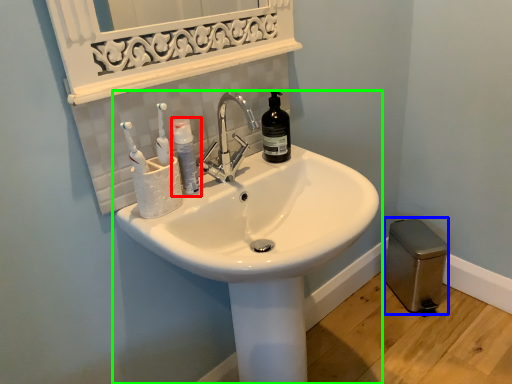
Question: Based on their relative distances, which object is farther from mouthwash (highlighted by a red box)? Choose from gray (highlighted by a blue box) and sink (highlighted by a green box).

Choices:
 (A) gray
 (B) sink

Answer: (A)